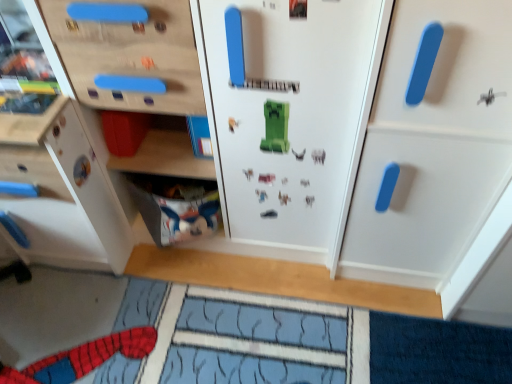
Question: In terms of height, does white matte cabinet at right, which is the first cabinetry from right to left, look taller or shorter compared to white matte cabinet at left, the second cabinetry viewed from the right?

Choices:
 (A) tall
 (B) short

Answer: (A)

Question: Is white matte cabinet at right, which is the first cabinetry from right to left, to the left or to the right of white matte cabinet at left, the second cabinetry viewed from the right, in the image?

Choices:
 (A) left
 (B) right

Answer: (B)

Question: Which is nearer to the white fabric at lower left?

Choices:
 (A) white matte cabinet at right, which is the first cabinetry from right to left
 (B) white matte cabinet at left, positioned as the first cabinetry in left-to-right order

Answer: (B)

Question: Estimate the real-world distances between objects in this image. Which object is closer to the white matte cabinet at left, positioned as the first cabinetry in left-to-right order?

Choices:
 (A) white fabric at lower left
 (B) white matte cabinet at right, arranged as the second cabinetry when viewed from the left

Answer: (A)